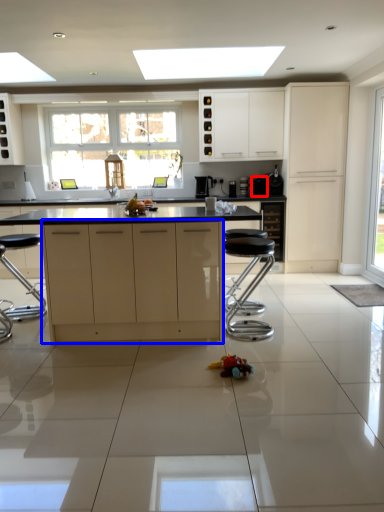
Question: Among these objects, which one is farthest to the camera, appliance (highlighted by a red box) or cabinetry (highlighted by a blue box)?

Choices:
 (A) appliance
 (B) cabinetry

Answer: (A)